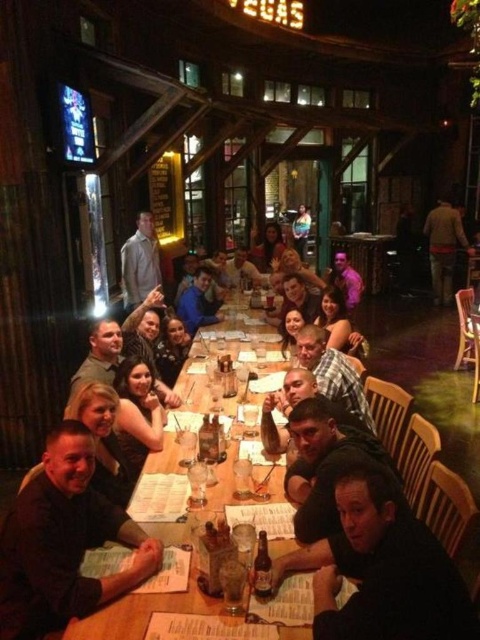
Question: Which point appears closest to the camera in this image?

Choices:
 (A) (311, 224)
 (B) (262, 244)

Answer: (B)

Question: Which point appears closest to the camera in this image?

Choices:
 (A) (264, 250)
 (B) (78, 484)
 (C) (214, 600)

Answer: (C)

Question: Is matte black shirt at lower left wider than light brown leather jacket at upper center?

Choices:
 (A) yes
 (B) no

Answer: (A)

Question: Does matte black shirt at lower left appear under brown wool sweater at right?

Choices:
 (A) no
 (B) yes

Answer: (B)

Question: Is wooden table at center closer to camera compared to light brown leather jacket at upper center?

Choices:
 (A) no
 (B) yes

Answer: (B)

Question: Which of these objects is positioned farthest from the plaid shirt at center?

Choices:
 (A) matte black shirt at lower right
 (B) smooth brown leather jacket at center
 (C) light gray shirt at center

Answer: (B)